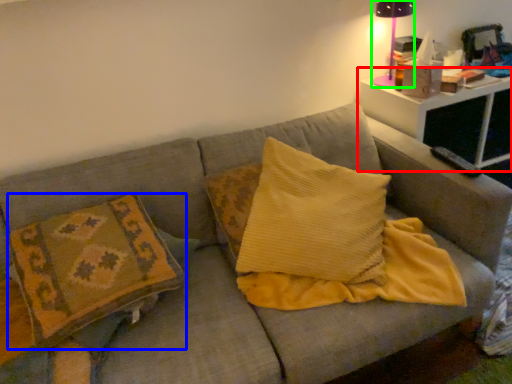
Question: Estimate the real-world distances between objects in this image. Which object is farther from table (highlighted by a red box), pillow (highlighted by a blue box) or table lamp (highlighted by a green box)?

Choices:
 (A) pillow
 (B) table lamp

Answer: (A)